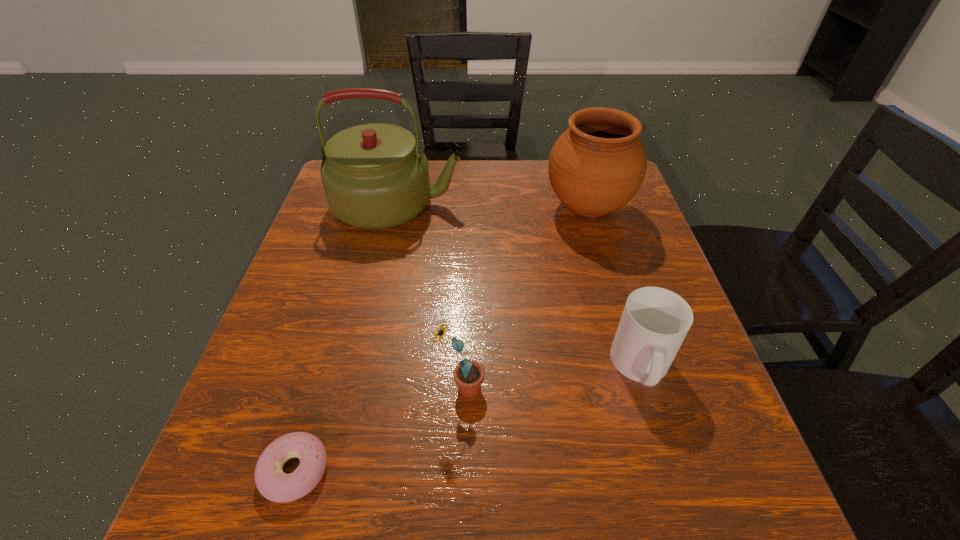
At what (x,y) coordinates should I click in order to perform the action: click on vacant region that satisfies the following two spatial constraints: 1. on the handle side of the second shortest object; 2. on the flower of the third shortest object. Please return your answer as a coordinate pair (x, y). The image size is (960, 540). Looking at the image, I should click on (648, 388).